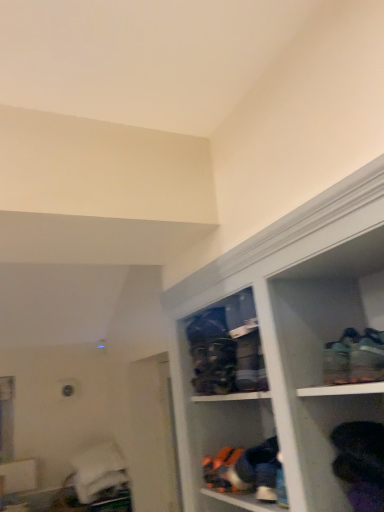
Question: Is matte plastic shoe rack at center turned away from green fabric shoe at upper right?

Choices:
 (A) no
 (B) yes

Answer: (A)

Question: From a real-world perspective, is matte plastic shoe rack at center on green fabric shoe at upper right?

Choices:
 (A) no
 (B) yes

Answer: (B)

Question: Does matte plastic shoe rack at center have a lesser width compared to green fabric shoe at upper right?

Choices:
 (A) no
 (B) yes

Answer: (B)

Question: Is matte plastic shoe rack at center bigger than green fabric shoe at upper right?

Choices:
 (A) no
 (B) yes

Answer: (B)

Question: Is matte plastic shoe rack at center not near green fabric shoe at upper right?

Choices:
 (A) no
 (B) yes

Answer: (A)

Question: From a real-world perspective, is matte plastic shoe rack at center positioned above or below black fabric shoes at lower right?

Choices:
 (A) below
 (B) above

Answer: (B)

Question: Relative to black fabric shoes at lower right, is matte plastic shoe rack at center in front or behind?

Choices:
 (A) behind
 (B) front

Answer: (A)

Question: From the image's perspective, is matte plastic shoe rack at center positioned above or below black fabric shoes at lower right?

Choices:
 (A) above
 (B) below

Answer: (A)

Question: Looking at their shapes, would you say matte plastic shoe rack at center is wider or thinner than black fabric shoes at lower right?

Choices:
 (A) thin
 (B) wide

Answer: (A)

Question: Based on their sizes in the image, would you say matte plastic shoe rack at center is bigger or smaller than green fabric shoe at upper right?

Choices:
 (A) small
 (B) big

Answer: (B)

Question: In the image, is matte plastic shoe rack at center positioned in front of or behind green fabric shoe at upper right?

Choices:
 (A) behind
 (B) front

Answer: (A)

Question: Based on their positions, is matte plastic shoe rack at center located to the left or right of green fabric shoe at upper right?

Choices:
 (A) right
 (B) left

Answer: (B)

Question: Is point (203, 315) closer or farther from the camera than point (377, 372)?

Choices:
 (A) farther
 (B) closer

Answer: (A)

Question: From the image's perspective, is green fabric shoe at upper right positioned above or below black fabric shoes at lower right?

Choices:
 (A) below
 (B) above

Answer: (B)

Question: Is green fabric shoe at upper right in front of or behind black fabric shoes at lower right in the image?

Choices:
 (A) front
 (B) behind

Answer: (B)